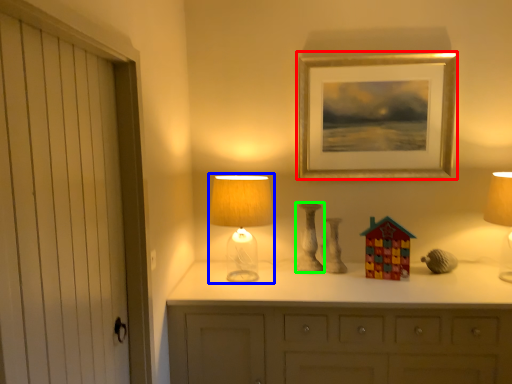
Question: Estimate the real-world distances between objects in this image. Which object is farther from picture frame (highlighted by a red box), table lamp (highlighted by a blue box) or candle holder (highlighted by a green box)?

Choices:
 (A) table lamp
 (B) candle holder

Answer: (A)